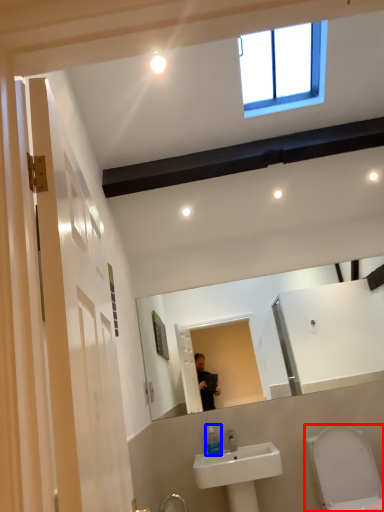
Question: Among these objects, which one is farthest to the camera, toilet (highlighted by a red box) or soap dispenser (highlighted by a blue box)?

Choices:
 (A) toilet
 (B) soap dispenser

Answer: (B)